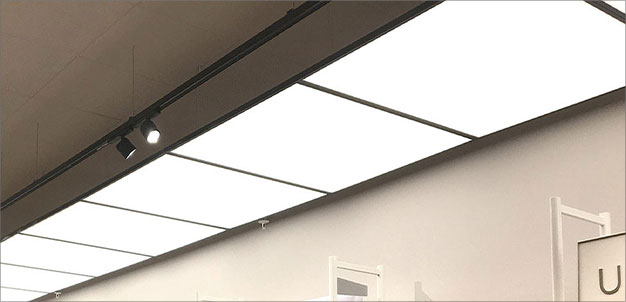
At what (x,y) coordinates should I click in order to perform the action: click on flat surfaces. Please return your answer as a coordinate pair (x, y). Looking at the image, I should click on (67, 55), (504, 69), (456, 211).